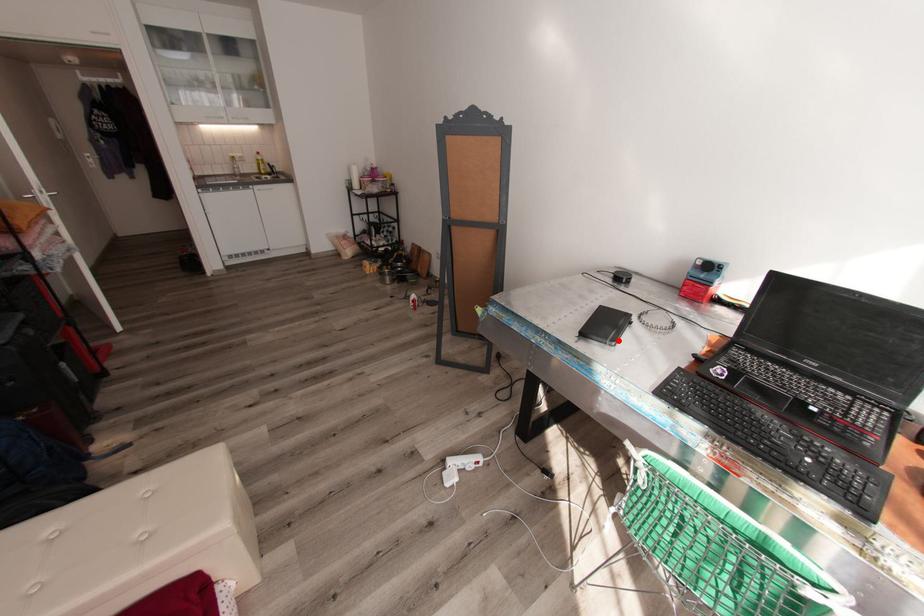
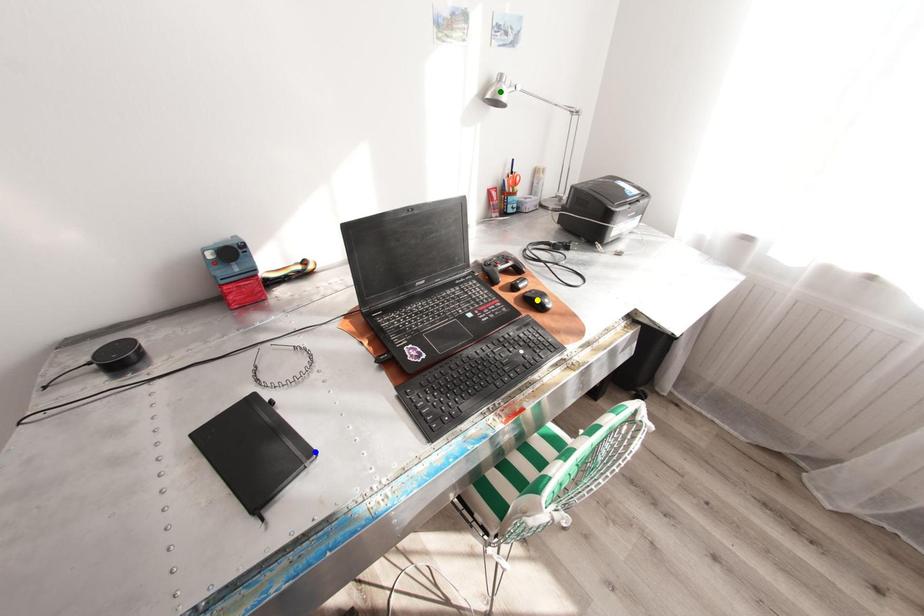
Question: I am providing you with two images of the same scene from different viewpoints. A red point is marked on the first image. You are given multiple points on the second image. In image 2, which mark is for the same physical point as the one in image 1?

Choices:
 (A) blue point
 (B) green point
 (C) yellow point

Answer: (A)